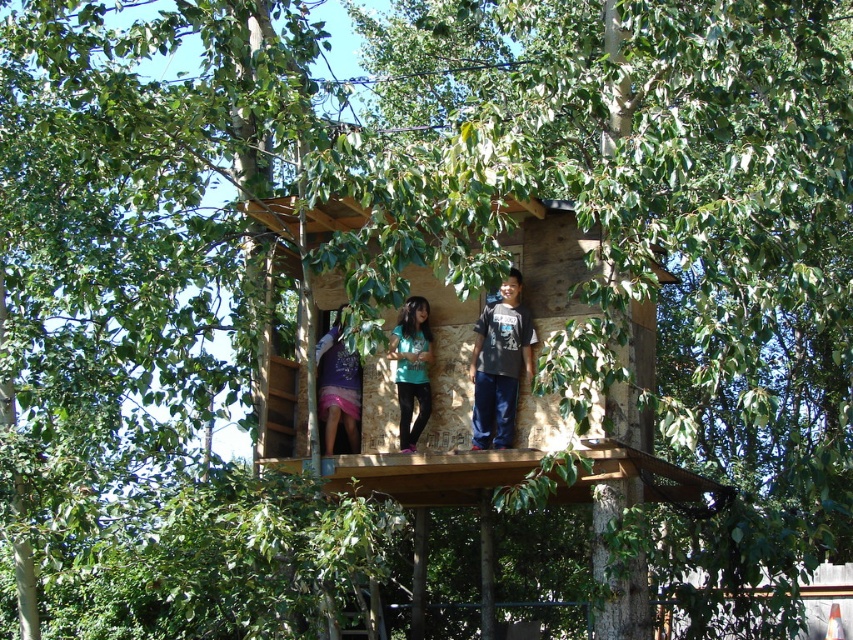
You are a parent trying to determine which child to bring a snack to first. You see the teal matte shirt at center and the matte purple dress at center. Which child is closer to the center of the treehouse?

The teal matte shirt at center and the matte purple dress at center are both at the center, so they are equally close to the center of the treehouse.

You are a parent looking at the treehouse and want to ensure safety for your children. Considering the two children in the center, the teal matte shirt at center and the matte purple dress at center, which child is standing higher in the treehouse?

The teal matte shirt at center is taller than the matte purple dress at center, so the child wearing the teal matte shirt at center is standing higher in the treehouse.